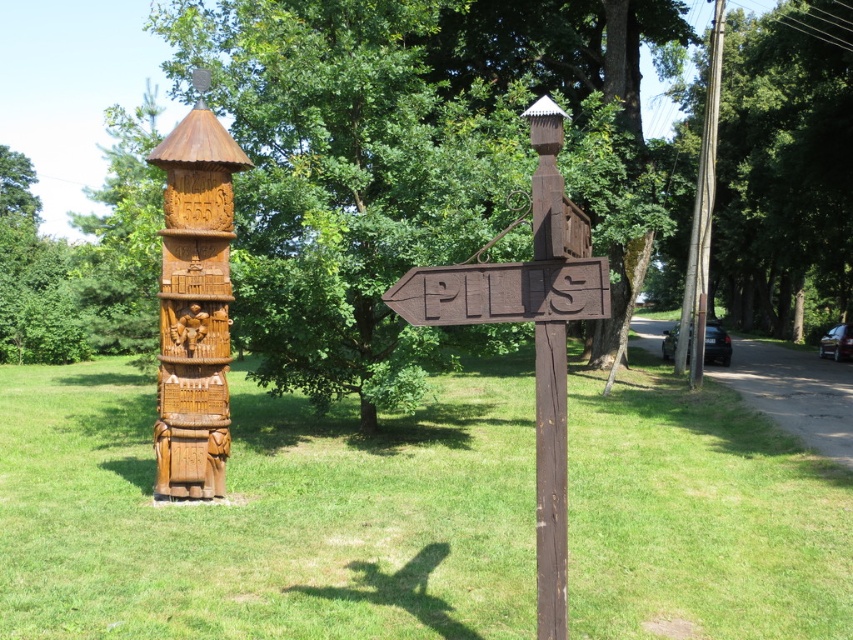
Question: Is the position of brown wooden signpost at center less distant than that of carved wood totem pole at center?

Choices:
 (A) no
 (B) yes

Answer: (B)

Question: Is brown wooden signpost at center below brown wooden sign at center-left?

Choices:
 (A) yes
 (B) no

Answer: (A)

Question: Is green grass at left behind brown wooden signpost at center?

Choices:
 (A) no
 (B) yes

Answer: (B)

Question: Which point is closer to the camera taking this photo?

Choices:
 (A) pos(416,307)
 (B) pos(173,296)

Answer: (A)

Question: Among these objects, which one is nearest to the camera?

Choices:
 (A) carved wood totem pole at center
 (B) green grass at left

Answer: (B)

Question: Which point is farther to the camera?

Choices:
 (A) (540, 392)
 (B) (546, 310)

Answer: (B)